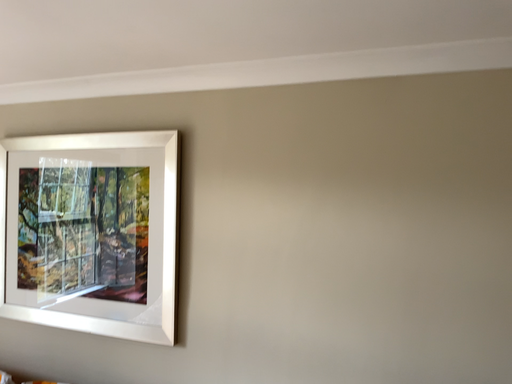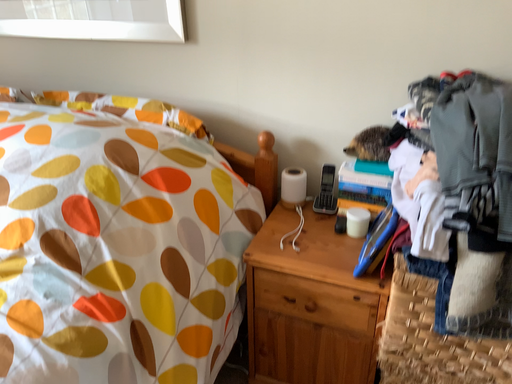
Question: How did the camera likely rotate when shooting the video?

Choices:
 (A) rotated downward
 (B) rotated upward

Answer: (A)